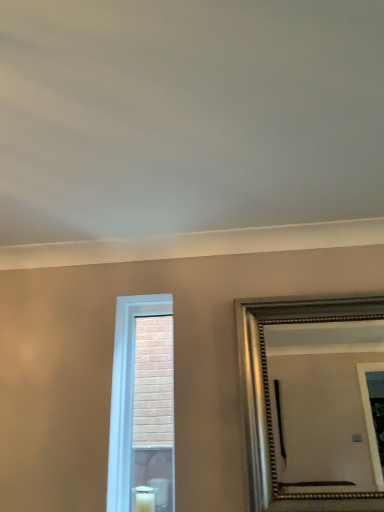
Question: Is white glass window at center taller or shorter than white wax candle at lower center?

Choices:
 (A) short
 (B) tall

Answer: (B)

Question: From a real-world perspective, is white glass window at center physically located above or below white wax candle at lower center?

Choices:
 (A) above
 (B) below

Answer: (A)

Question: Which object is the farthest from the white wax candle at lower center?

Choices:
 (A) silver metallic mirror at right
 (B) white glass window at center

Answer: (A)

Question: Considering the real-world distances, which object is closest to the white glass window at center?

Choices:
 (A) white wax candle at lower center
 (B) silver metallic mirror at right

Answer: (A)